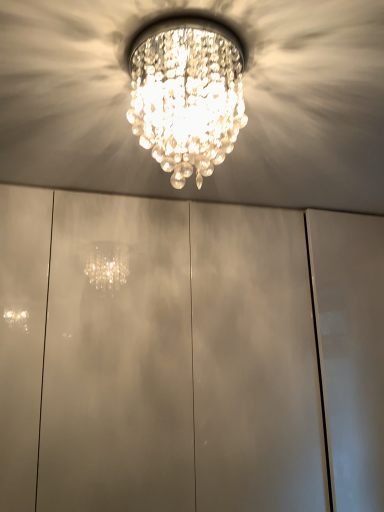
What do you see at coordinates (186, 92) in the screenshot? I see `clear crystal chandelier at center` at bounding box center [186, 92].

At what (x,y) coordinates should I click in order to perform the action: click on clear crystal chandelier at center. Please return your answer as a coordinate pair (x, y). The height and width of the screenshot is (512, 384). Looking at the image, I should click on (186, 92).

The width and height of the screenshot is (384, 512). Find the location of `glossy white cabinet at center`. glossy white cabinet at center is located at coordinates (179, 360).

This screenshot has width=384, height=512. What do you see at coordinates (179, 360) in the screenshot?
I see `glossy white cabinet at center` at bounding box center [179, 360].

What is the approximate width of glossy white cabinet at center?

64.76 centimeters.

Find the location of a particular element. This screenshot has width=384, height=512. clear crystal chandelier at center is located at coordinates (186, 92).

Visually, is glossy white cabinet at center positioned to the left or to the right of clear crystal chandelier at center?

In the image, glossy white cabinet at center appears on the right side of clear crystal chandelier at center.

Is glossy white cabinet at center positioned in front of clear crystal chandelier at center?

No, glossy white cabinet at center is behind clear crystal chandelier at center.

Is point (197, 493) closer to viewer compared to point (190, 23)?

No, (197, 493) is further to viewer.

From the image's perspective, would you say glossy white cabinet at center is shown under clear crystal chandelier at center?

Yes, from the image's perspective, glossy white cabinet at center is below clear crystal chandelier at center.

From a real-world perspective, which is physically above, glossy white cabinet at center or clear crystal chandelier at center?

clear crystal chandelier at center.

Is glossy white cabinet at center wider or thinner than clear crystal chandelier at center?

Considering their sizes, glossy white cabinet at center looks broader than clear crystal chandelier at center.

Can you confirm if glossy white cabinet at center is shorter than clear crystal chandelier at center?

Incorrect, the height of glossy white cabinet at center does not fall short of that of clear crystal chandelier at center.

Does glossy white cabinet at center have a smaller size compared to clear crystal chandelier at center?

No, glossy white cabinet at center is not smaller than clear crystal chandelier at center.

Is clear crystal chandelier at center inside glossy white cabinet at center?

Actually, clear crystal chandelier at center is outside glossy white cabinet at center.

Would you say glossy white cabinet at center is a long distance from clear crystal chandelier at center?

glossy white cabinet at center is actually quite close to clear crystal chandelier at center.

Looking at this image, does glossy white cabinet at center turn towards clear crystal chandelier at center?

Yes, glossy white cabinet at center is aimed at clear crystal chandelier at center.

Can you tell me how much glossy white cabinet at center and clear crystal chandelier at center differ in facing direction?

3.53 degrees.

Identify the location of lamp that is above the glossy white cabinet at center (from the image's perspective). This screenshot has width=384, height=512. pos(186,92).

Considering the relative positions of clear crystal chandelier at center and glossy white cabinet at center in the image provided, is clear crystal chandelier at center to the right of glossy white cabinet at center from the viewer's perspective?

No, clear crystal chandelier at center is not to the right of glossy white cabinet at center.

Which object is closer to the camera taking this photo, clear crystal chandelier at center or glossy white cabinet at center?

clear crystal chandelier at center.

Consider the image. Which point is more forward, (222, 147) or (90, 407)?

The point (222, 147) is closer.

From the image's perspective, is clear crystal chandelier at center below glossy white cabinet at center?

Incorrect, from the image's perspective, clear crystal chandelier at center is higher than glossy white cabinet at center.

Looking at this image, from a real-world perspective, which is physically below, clear crystal chandelier at center or glossy white cabinet at center?

glossy white cabinet at center.

Between clear crystal chandelier at center and glossy white cabinet at center, which one has smaller width?

clear crystal chandelier at center is thinner.

Considering the sizes of clear crystal chandelier at center and glossy white cabinet at center in the image, is clear crystal chandelier at center taller or shorter than glossy white cabinet at center?

Considering their sizes, clear crystal chandelier at center has less height than glossy white cabinet at center.

Who is bigger, clear crystal chandelier at center or glossy white cabinet at center?

glossy white cabinet at center is bigger.

Can we say clear crystal chandelier at center lies outside glossy white cabinet at center?

Yes, clear crystal chandelier at center is located beyond the bounds of glossy white cabinet at center.

Based on the photo, does clear crystal chandelier at center touch glossy white cabinet at center?

No, clear crystal chandelier at center is not making contact with glossy white cabinet at center.

Is clear crystal chandelier at center positioned with its back to glossy white cabinet at center?

Yes.

Can you tell me how much clear crystal chandelier at center and glossy white cabinet at center differ in facing direction?

There is a 3.53-degree angle between the facing directions of clear crystal chandelier at center and glossy white cabinet at center.

At what (x,y) coordinates should I click in order to perform the action: click on lamp on the left of glossy white cabinet at center. Please return your answer as a coordinate pair (x, y). This screenshot has height=512, width=384. Looking at the image, I should click on 186,92.

In the image, there is a clear crystal chandelier at center. Identify the location of glass door below it (from a real-world perspective). (179, 360).

Where is `lamp in front of the glossy white cabinet at center`? This screenshot has height=512, width=384. lamp in front of the glossy white cabinet at center is located at coordinates (186, 92).